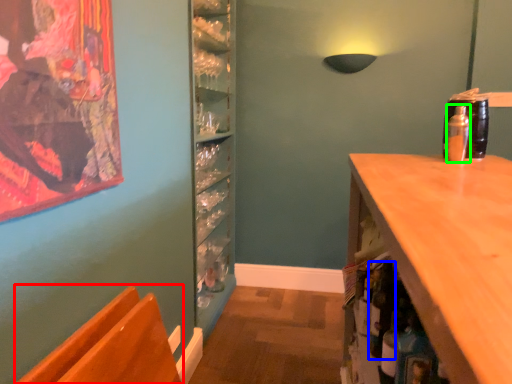
Question: Estimate the real-world distances between objects in this image. Which object is closer to chair (highlighted by a red box), bottle (highlighted by a blue box) or bottle (highlighted by a green box)?

Choices:
 (A) bottle
 (B) bottle

Answer: (A)